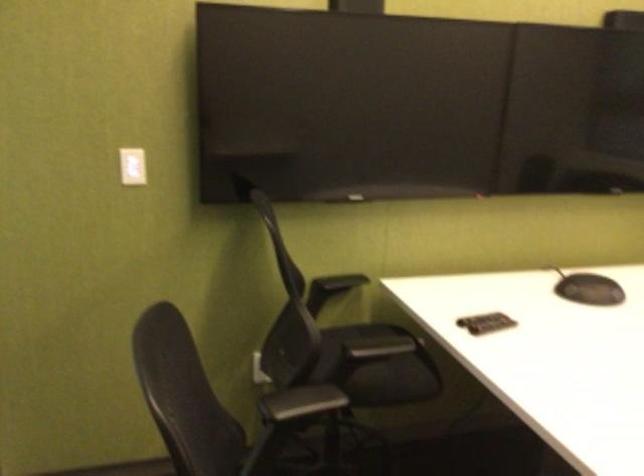
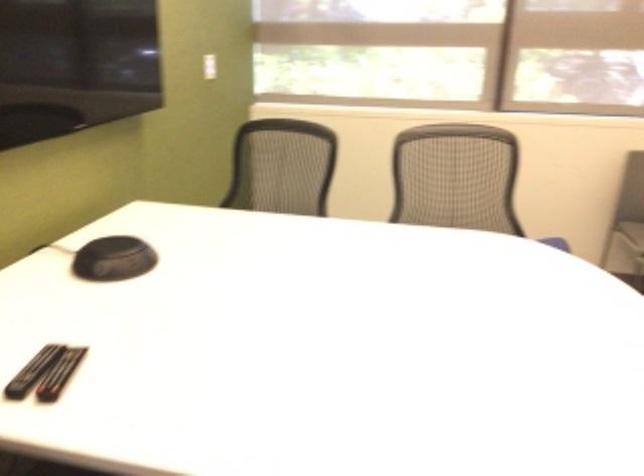
Question: How did the camera likely rotate?

Choices:
 (A) Left
 (B) Right
 (C) Up
 (D) Down

Answer: (B)